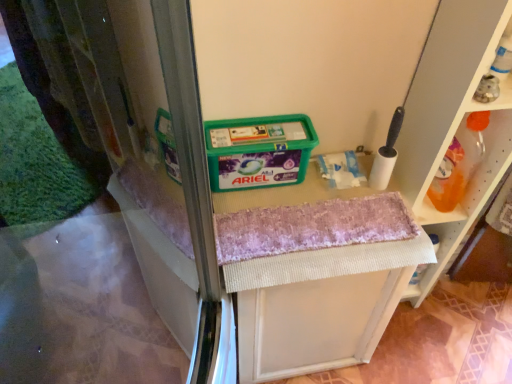
Locate an element on the screen. This screenshot has width=512, height=384. vacant point above pink textured bath towel at center (from a real-world perspective) is located at coordinates (316, 220).